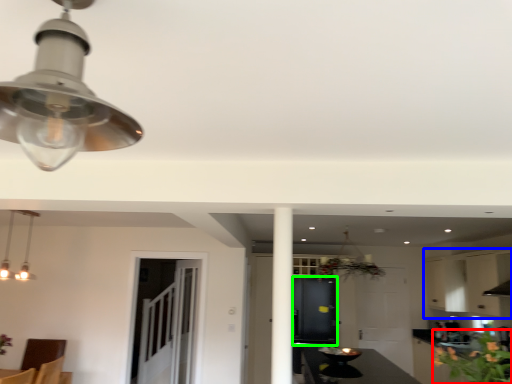
Question: Which is nearer to the flower (highlighted by a red box)? cabinetry (highlighted by a blue box) or cabinetry (highlighted by a green box).

Choices:
 (A) cabinetry
 (B) cabinetry

Answer: (B)